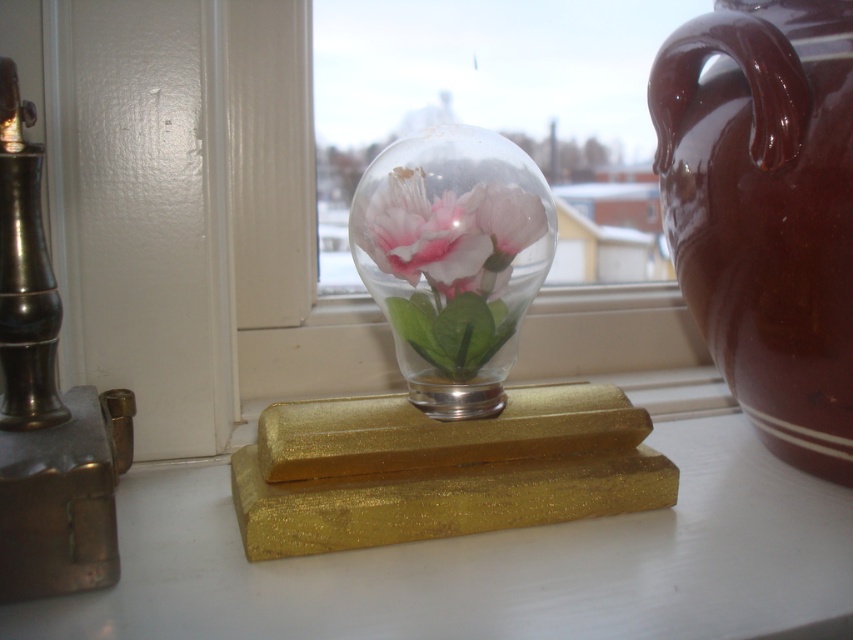
You are standing in front of the windowsill setup. You see a glass dome with artificial flowers at the center and a vintage lamp on the left. There is also a point marked at coordinates (x=766, y=211). What object is located at that point?

The point at coordinates (x=766, y=211) corresponds to the burgundy ceramic vase at right.